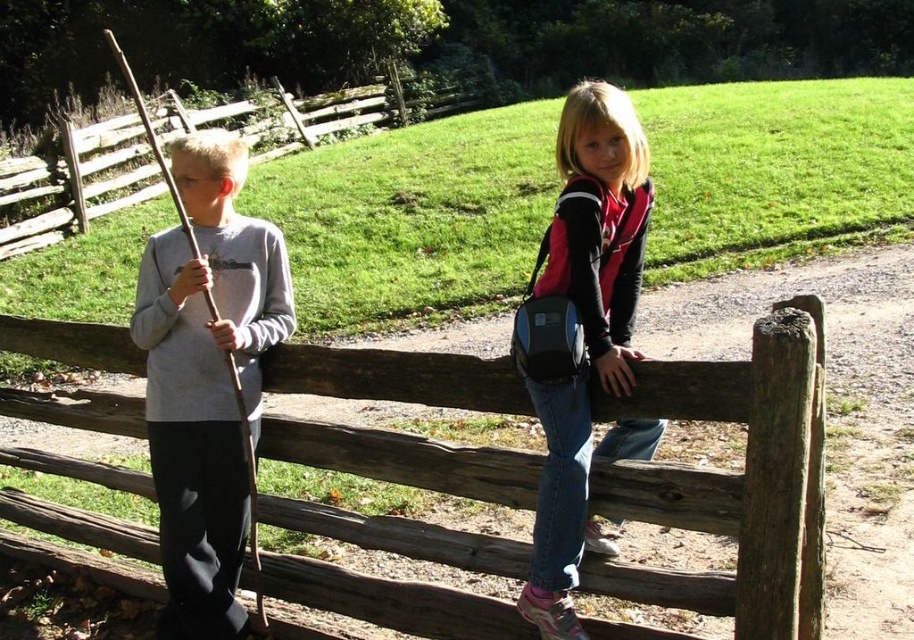
Between weathered wood fence at center and brown wooden fence at left, which one has more height?

brown wooden fence at left

Is weathered wood fence at center positioned behind brown wooden fence at left?

No, weathered wood fence at center is in front of brown wooden fence at left.

Does point (445, 628) come in front of point (273, 112)?

Yes, it is in front of point (273, 112).

Identify the location of weathered wood fence at center. (732, 481).

Does gray matte stick at left appear over denim jeans at center?

Actually, gray matte stick at left is below denim jeans at center.

Who is more distant from viewer, (234, 589) or (529, 374)?

Point (234, 589)

Identify the location of gray matte stick at left. The height and width of the screenshot is (640, 914). (206, 378).

Describe the element at coordinates (732, 481) in the screenshot. The height and width of the screenshot is (640, 914). I see `weathered wood fence at center` at that location.

Is weathered wood fence at center taller than denim jeans at center?

No, weathered wood fence at center is not taller than denim jeans at center.

Describe the element at coordinates (732, 481) in the screenshot. I see `weathered wood fence at center` at that location.

In order to click on weathered wood fence at center in this screenshot , I will do `click(732, 481)`.